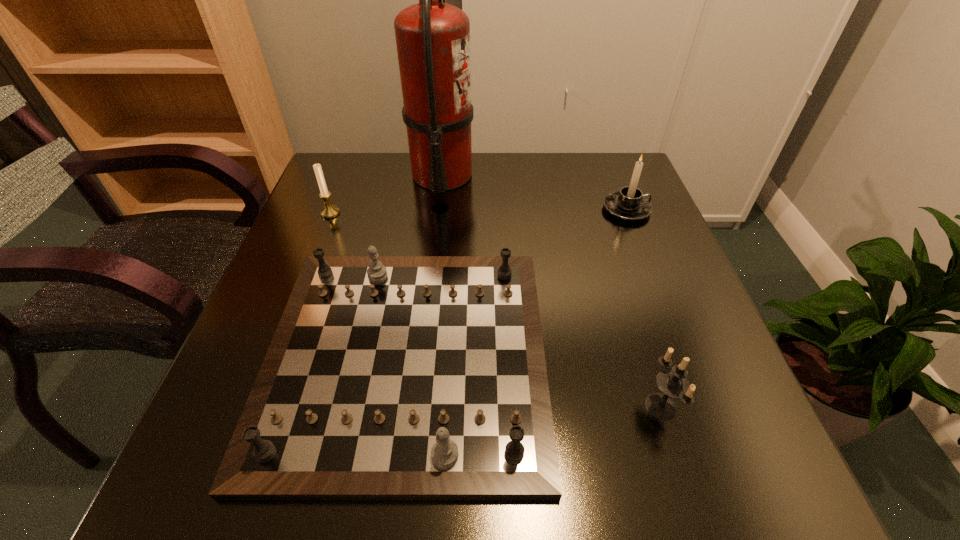
At what (x,y) coordinates should I click in order to perform the action: click on the tallest object. Please return your answer as a coordinate pair (x, y). The width and height of the screenshot is (960, 540). Looking at the image, I should click on (433, 38).

Where is `the leftmost candle holder`? the leftmost candle holder is located at coordinates [328, 211].

Find the location of a particular element. Image resolution: width=960 pixels, height=540 pixels. the nearest candle holder is located at coordinates (673, 383).

Where is `the shortest object`? The height and width of the screenshot is (540, 960). the shortest object is located at coordinates (388, 377).

Locate an element on the screen. This screenshot has height=540, width=960. free spot located 0.340m toward the nozzle of the tallest object is located at coordinates (601, 176).

At what (x,y) coordinates should I click in order to perform the action: click on vacant space positioned on the right of the leftmost candle holder. Please return your answer as a coordinate pair (x, y). Looking at the image, I should click on (435, 213).

Find the location of a particular element. The height and width of the screenshot is (540, 960). blank space located on the left of the nearest candle holder is located at coordinates (608, 407).

The height and width of the screenshot is (540, 960). Find the location of `fire extinguisher present at the far edge`. fire extinguisher present at the far edge is located at coordinates (433, 38).

The height and width of the screenshot is (540, 960). Identify the location of candle holder at the far edge. (630, 204).

Identify the location of object that is at the near edge. (388, 377).